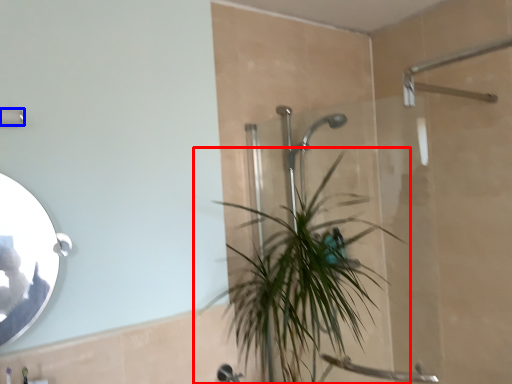
Question: Among these objects, which one is farthest to the camera, houseplant (highlighted by a red box) or shower (highlighted by a blue box)?

Choices:
 (A) houseplant
 (B) shower

Answer: (A)